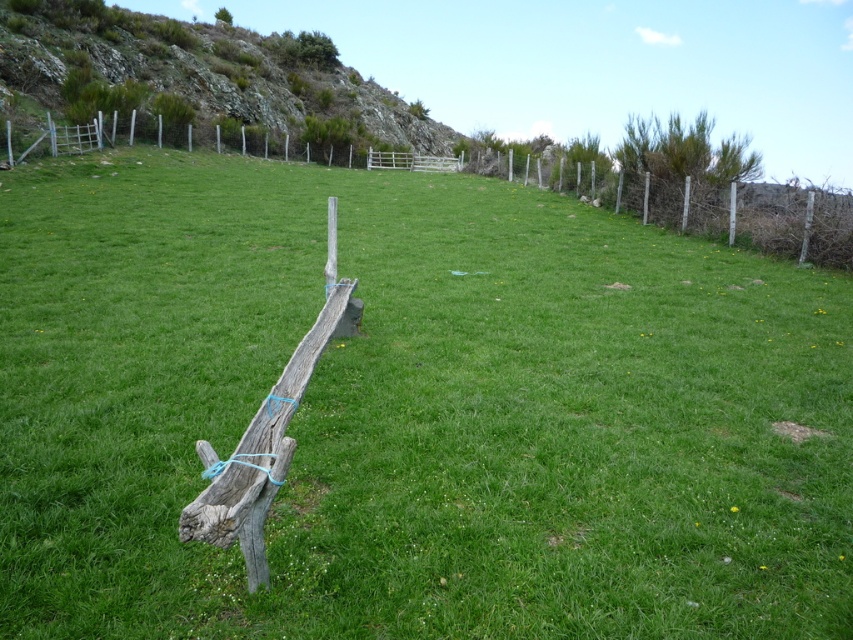
Question: From the image, what is the correct spatial relationship of rough textured rock at upper left in relation to weathered wood fence at center?

Choices:
 (A) below
 (B) above

Answer: (B)

Question: Is rough textured rock at upper left below weathered wood fence at center?

Choices:
 (A) yes
 (B) no

Answer: (B)

Question: Observing the image, what is the correct spatial positioning of rough textured rock at upper left in reference to weathered wood fence at center?

Choices:
 (A) below
 (B) above

Answer: (B)

Question: Which of the following is the farthest from the observer?

Choices:
 (A) (64, 42)
 (B) (759, 234)

Answer: (A)

Question: Which object is farther from the camera taking this photo?

Choices:
 (A) weathered wood fence at center
 (B) rough textured rock at upper left

Answer: (B)